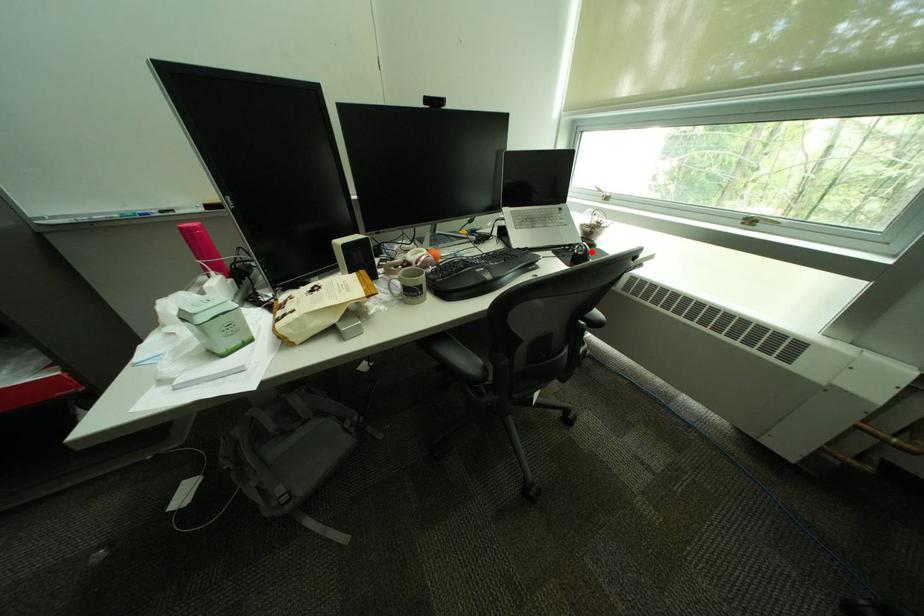
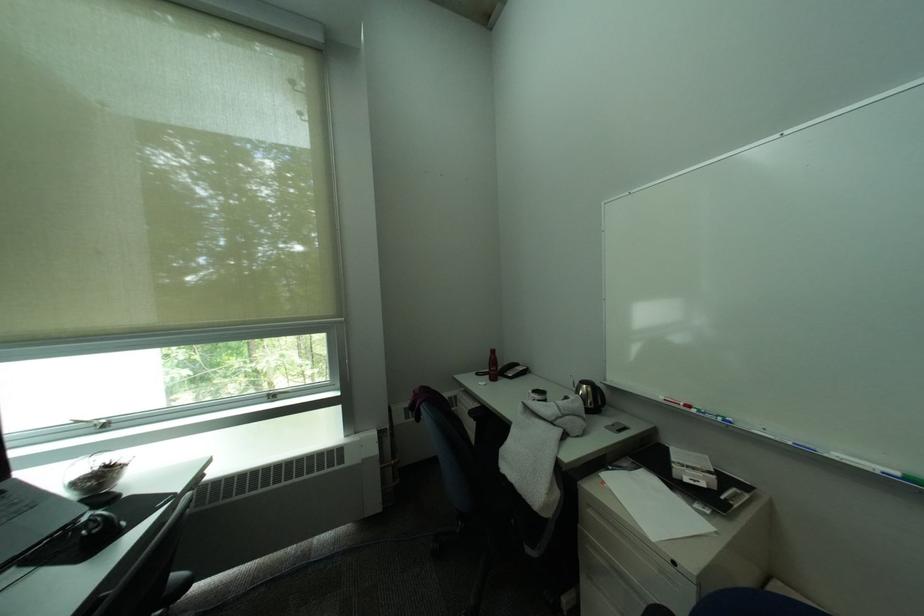
Where in the second image is the point corresponding to the highlighted location from the first image?

(106, 528)